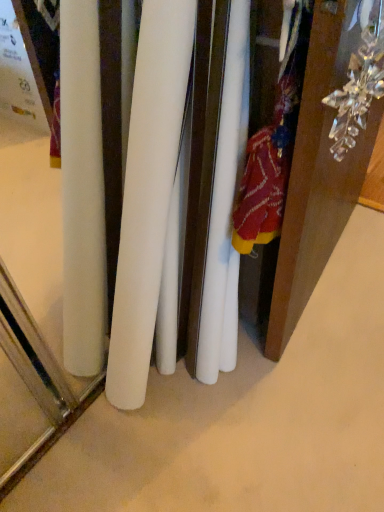
Locate an element on the screen. white matte surface at center is located at coordinates (247, 417).

The width and height of the screenshot is (384, 512). What do you see at coordinates (247, 417) in the screenshot? I see `white matte surface at center` at bounding box center [247, 417].

The height and width of the screenshot is (512, 384). What do you see at coordinates (359, 81) in the screenshot?
I see `clear crystal ornament at upper right` at bounding box center [359, 81].

The image size is (384, 512). I want to click on clear crystal ornament at upper right, so click(x=359, y=81).

Find the location of a particular element. This screenshot has height=512, width=384. white matte surface at center is located at coordinates (247, 417).

Is white matte surface at center at the right side of clear crystal ornament at upper right?

No, white matte surface at center is not to the right of clear crystal ornament at upper right.

Is white matte surface at center in front of clear crystal ornament at upper right?

No, the depth of white matte surface at center is greater than that of clear crystal ornament at upper right.

Considering the points (258, 370) and (377, 22), which point is behind, point (258, 370) or point (377, 22)?

The point (258, 370) is farther from the camera.

From the image's perspective, would you say white matte surface at center is shown under clear crystal ornament at upper right?

Yes, from the image's perspective, white matte surface at center is below clear crystal ornament at upper right.

From a real-world perspective, who is located lower, white matte surface at center or clear crystal ornament at upper right?

white matte surface at center.

Is white matte surface at center wider or thinner than clear crystal ornament at upper right?

white matte surface at center is wider than clear crystal ornament at upper right.

Is white matte surface at center shorter than clear crystal ornament at upper right?

Yes.

Does white matte surface at center have a smaller size compared to clear crystal ornament at upper right?

No, white matte surface at center is not smaller than clear crystal ornament at upper right.

Is white matte surface at center not inside clear crystal ornament at upper right?

white matte surface at center lies outside clear crystal ornament at upper right's area.

Is the surface of white matte surface at center in direct contact with clear crystal ornament at upper right?

white matte surface at center is not next to clear crystal ornament at upper right, and they're not touching.

Looking at this image, is white matte surface at center oriented away from clear crystal ornament at upper right?

white matte surface at center does not have its back to clear crystal ornament at upper right.

How different are the orientations of white matte surface at center and clear crystal ornament at upper right in degrees?

The angular difference between white matte surface at center and clear crystal ornament at upper right is 83.3 degrees.

How much distance is there between white matte surface at center and clear crystal ornament at upper right?

The distance of white matte surface at center from clear crystal ornament at upper right is 74.98 centimeters.

This screenshot has width=384, height=512. In order to click on surface beneath the clear crystal ornament at upper right (from a real-world perspective) in this screenshot , I will do `click(247, 417)`.

Considering the relative positions of clear crystal ornament at upper right and white matte surface at center in the image provided, is clear crystal ornament at upper right to the left or to the right of white matte surface at center?

In the image, clear crystal ornament at upper right appears on the right side of white matte surface at center.

Is clear crystal ornament at upper right in front of white matte surface at center?

Yes, it is in front of white matte surface at center.

Which point is more distant from viewer, (348,92) or (317,353)?

Point (317,353)

From the image's perspective, is clear crystal ornament at upper right located above or below white matte surface at center?

clear crystal ornament at upper right is situated higher than white matte surface at center in the image.

From a real-world perspective, is clear crystal ornament at upper right on top of white matte surface at center?

Yes.

In terms of width, does clear crystal ornament at upper right look wider or thinner when compared to white matte surface at center?

Result: In the image, clear crystal ornament at upper right appears to be more narrow than white matte surface at center.

Is clear crystal ornament at upper right taller than white matte surface at center?

Yes, clear crystal ornament at upper right is taller than white matte surface at center.

Considering the sizes of clear crystal ornament at upper right and white matte surface at center in the image, is clear crystal ornament at upper right bigger or smaller than white matte surface at center?

Considering their sizes, clear crystal ornament at upper right takes up less space than white matte surface at center.

Is clear crystal ornament at upper right outside of white matte surface at center?

Yes, clear crystal ornament at upper right is outside of white matte surface at center.

Are clear crystal ornament at upper right and white matte surface at center far apart?

clear crystal ornament at upper right is near white matte surface at center, not far away.

Does clear crystal ornament at upper right turn towards white matte surface at center?

No, clear crystal ornament at upper right is not facing towards white matte surface at center.

Measure the distance from clear crystal ornament at upper right to white matte surface at center.

A distance of 29.52 inches exists between clear crystal ornament at upper right and white matte surface at center.

At what (x,y) coordinates should I click in order to perform the action: click on accessory on the right of white matte surface at center. Please return your answer as a coordinate pair (x, y). This screenshot has height=512, width=384. Looking at the image, I should click on (359, 81).

Find the location of a particular element. This screenshot has width=384, height=512. surface that appears below the clear crystal ornament at upper right (from the image's perspective) is located at coordinates 247,417.

I want to click on accessory that appears on the right of white matte surface at center, so click(359, 81).